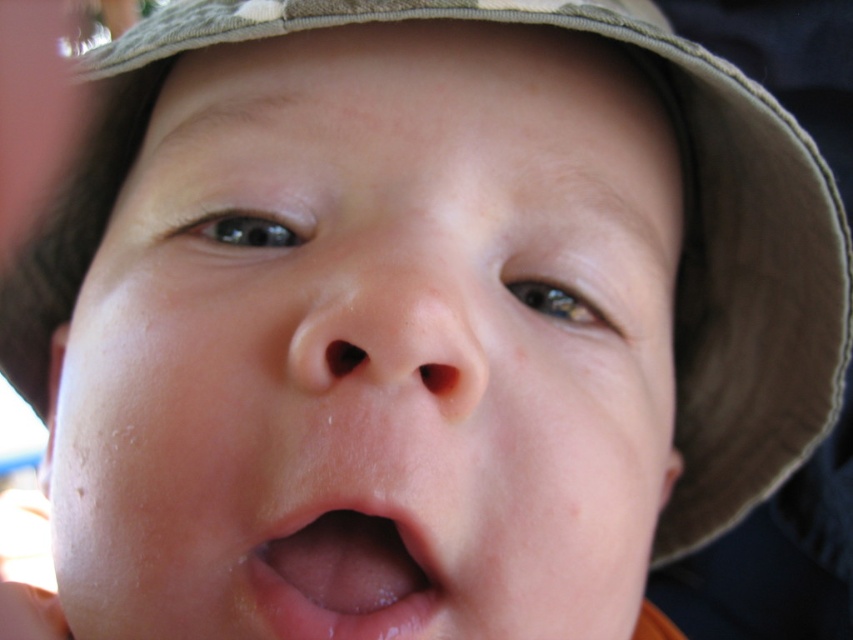
Question: Is smooth skin face at center to the right of pink smooth lips at center from the viewer's perspective?

Choices:
 (A) yes
 (B) no

Answer: (B)

Question: Does smooth skin face at center have a lesser width compared to pink smooth lips at center?

Choices:
 (A) yes
 (B) no

Answer: (B)

Question: Which of the following is the farthest from the observer?

Choices:
 (A) smooth skin face at center
 (B) pink smooth lips at center

Answer: (B)

Question: In this image, where is smooth skin face at center located relative to pink smooth lips at center?

Choices:
 (A) right
 (B) left

Answer: (B)